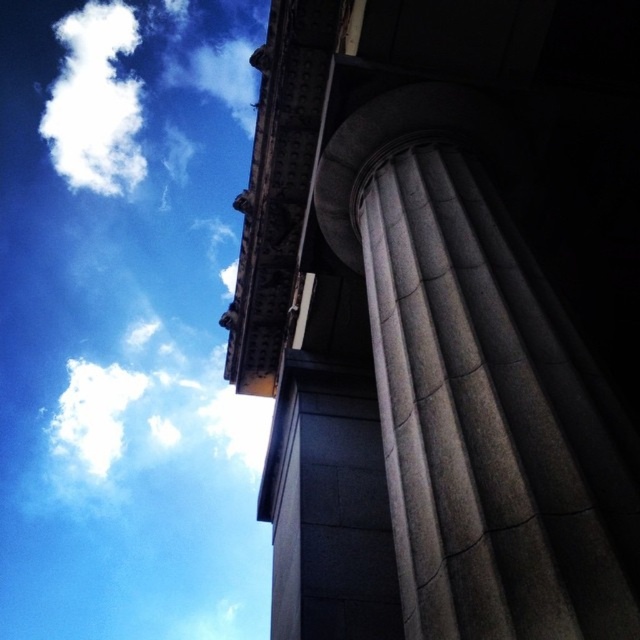
Who is shorter, gray stone column at upper right or white fluffy cloud at upper left?

Standing shorter between the two is gray stone column at upper right.

Between point (488, 177) and point (76, 182), which one is positioned behind?

Positioned behind is point (76, 182).

Describe the element at coordinates (445, 316) in the screenshot. I see `gray stone column at upper right` at that location.

This screenshot has height=640, width=640. I want to click on gray stone column at upper right, so click(445, 316).